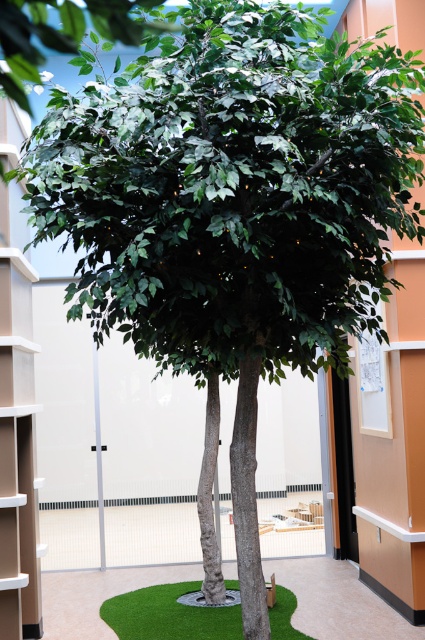
Question: Where is green artificial turf at center located in relation to green matte tree trunk at center in the image?

Choices:
 (A) above
 (B) below

Answer: (A)

Question: Which point is farther to the camera?

Choices:
 (A) (204, 604)
 (B) (167, 618)

Answer: (A)

Question: Can you confirm if green artificial turf at center is positioned to the left of green matte tree trunk at center?

Choices:
 (A) yes
 (B) no

Answer: (A)

Question: Which point is closer to the camera?

Choices:
 (A) (198, 609)
 (B) (190, 600)

Answer: (A)

Question: Can you confirm if green artificial turf at center is thinner than green matte tree trunk at center?

Choices:
 (A) yes
 (B) no

Answer: (B)

Question: Among these points, which one is nearest to the camera?

Choices:
 (A) pyautogui.click(x=203, y=593)
 (B) pyautogui.click(x=198, y=618)

Answer: (B)